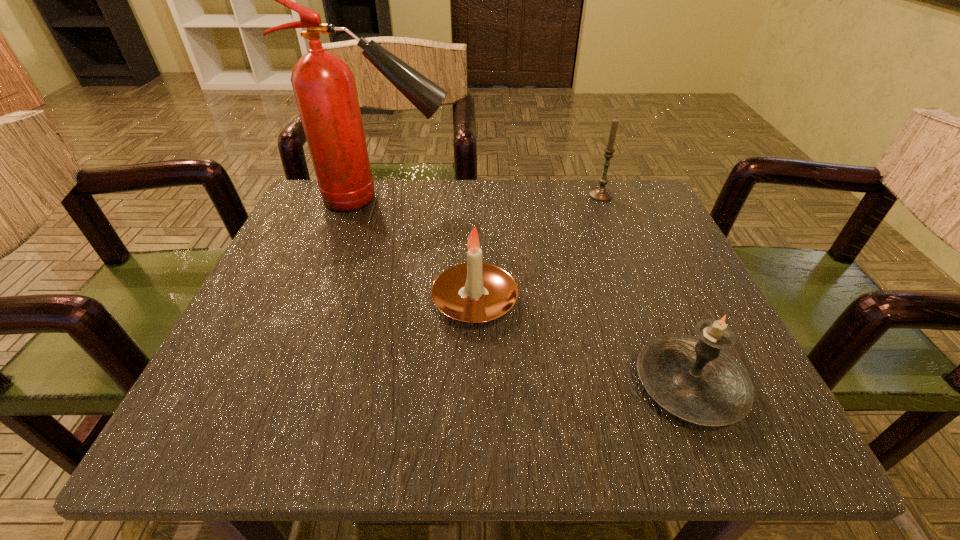
Identify the location of vacant position in the image that satisfies the following two spatial constraints: 1. on the front side of the farthest candle; 2. on the right side of the nearest candle. pos(673,385).

Locate an element on the screen. The height and width of the screenshot is (540, 960). free space in the image that satisfies the following two spatial constraints: 1. at the nozzle end of the third farthest object; 2. on the right side of the tallest object is located at coordinates (351, 302).

Locate an element on the screen. The image size is (960, 540). vacant space that satisfies the following two spatial constraints: 1. on the back side of the leftmost candle; 2. on the left side of the farthest candle is located at coordinates (476, 195).

Where is `vacant space that satisfies the following two spatial constraints: 1. at the nozzle end of the fire extinguisher; 2. on the left side of the nearest candle`? The image size is (960, 540). vacant space that satisfies the following two spatial constraints: 1. at the nozzle end of the fire extinguisher; 2. on the left side of the nearest candle is located at coordinates (325, 385).